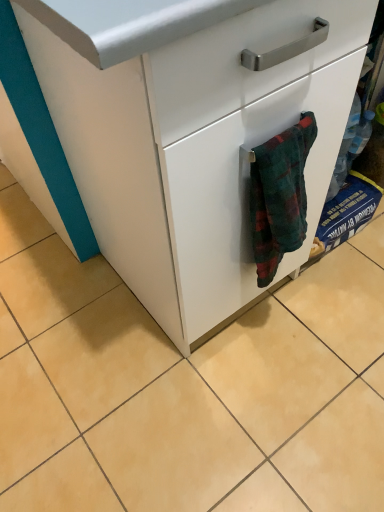
Question: Can you confirm if white matte cabinet at center is positioned to the left of flannel bath towel at lower right?

Choices:
 (A) yes
 (B) no

Answer: (B)

Question: Is white matte cabinet at center to the right of flannel bath towel at lower right from the viewer's perspective?

Choices:
 (A) no
 (B) yes

Answer: (B)

Question: Considering the relative sizes of white matte cabinet at center and flannel bath towel at lower right in the image provided, is white matte cabinet at center smaller than flannel bath towel at lower right?

Choices:
 (A) yes
 (B) no

Answer: (B)

Question: From a real-world perspective, is white matte cabinet at center positioned over flannel bath towel at lower right based on gravity?

Choices:
 (A) no
 (B) yes

Answer: (A)

Question: Does white matte cabinet at center have a lesser height compared to flannel bath towel at lower right?

Choices:
 (A) no
 (B) yes

Answer: (A)

Question: Is white matte cabinet at center behind flannel bath towel at lower right?

Choices:
 (A) no
 (B) yes

Answer: (A)

Question: From the image's perspective, does flannel bath towel at lower right appear lower than white matte cabinet at center?

Choices:
 (A) no
 (B) yes

Answer: (B)

Question: Considering the relative sizes of flannel bath towel at lower right and white matte cabinet at center in the image provided, is flannel bath towel at lower right taller than white matte cabinet at center?

Choices:
 (A) yes
 (B) no

Answer: (B)

Question: Is flannel bath towel at lower right aimed at white matte cabinet at center?

Choices:
 (A) yes
 (B) no

Answer: (B)

Question: Considering the relative sizes of flannel bath towel at lower right and white matte cabinet at center in the image provided, is flannel bath towel at lower right wider than white matte cabinet at center?

Choices:
 (A) no
 (B) yes

Answer: (A)

Question: From the image's perspective, would you say flannel bath towel at lower right is positioned over white matte cabinet at center?

Choices:
 (A) no
 (B) yes

Answer: (A)

Question: Is flannel bath towel at lower right to the left of white matte cabinet at center from the viewer's perspective?

Choices:
 (A) yes
 (B) no

Answer: (A)

Question: Is flannel bath towel at lower right spatially inside white matte cabinet at center, or outside of it?

Choices:
 (A) inside
 (B) outside

Answer: (A)